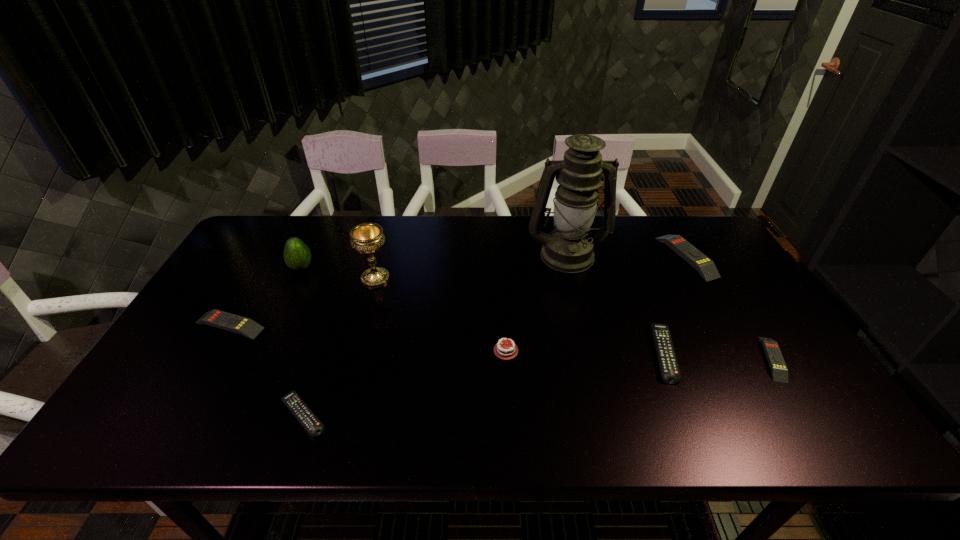
Image resolution: width=960 pixels, height=540 pixels. In the image, there is a desktop. Find the location of `vacant space at the far edge`. vacant space at the far edge is located at coordinates (640, 246).

In the image, there is a desktop. Where is `vacant space at the near edge`? The image size is (960, 540). vacant space at the near edge is located at coordinates (668, 411).

Locate an element on the screen. The width and height of the screenshot is (960, 540). vacant space at the right edge of the desktop is located at coordinates (807, 403).

This screenshot has height=540, width=960. Find the location of `free point at the near right corner`. free point at the near right corner is located at coordinates (821, 410).

Find the location of a particular element. The width and height of the screenshot is (960, 540). blank region between the nearest remote control and the sixth tallest object is located at coordinates (266, 370).

The image size is (960, 540). Find the location of `vacant region between the green avocado and the shortest remote control`. vacant region between the green avocado and the shortest remote control is located at coordinates pos(302,341).

Identify the location of free spot between the fourth shortest object and the oil lamp. (398, 290).

Identify the location of vacant area that lies between the leftmost remote control and the avocado. This screenshot has width=960, height=540. (266, 296).

Find the location of a particular element. vacant space that's between the farthest yellow remote control and the smallest yellow remote control is located at coordinates (730, 308).

Identify the location of vacant space that is in between the red chocolate cake and the oil lamp. (537, 302).